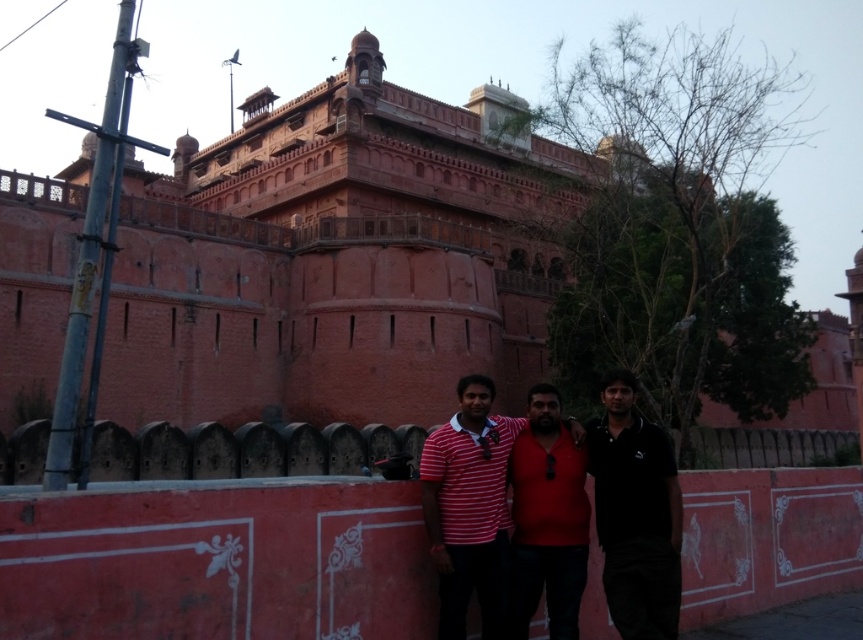
You are a photographer trying to capture a group photo of the three people wearing the red striped shirt at center and the matte red shirt at center. Since you want to ensure everyone is visible, which person should stand at the back to avoid blocking others?

The red striped shirt at center should stand at the back because it is much taller than the matte red shirt at center, so placing the taller individual behind would ensure visibility for the shorter one.

You are standing at the point marked as point [553,586] in the image. You want to take a photo of the historic building with your camera. The camera is 31 meters away from you. Is the camera close enough to capture the entire building in one shot?

The camera is 31.00 meters away from point [553,586], so it is close enough to capture the entire building in one shot.

You are a photographer trying to capture a group photo of the two people wearing the red striped shirt at center and the black matte shirt at center. Since you want to ensure both are visible in the frame, which person should you position closer to the front to avoid being blocked by the other?

The red striped shirt at center is taller than the black matte shirt at center, so you should position the black matte shirt at center closer to the front to avoid being blocked by the taller red striped shirt at center.